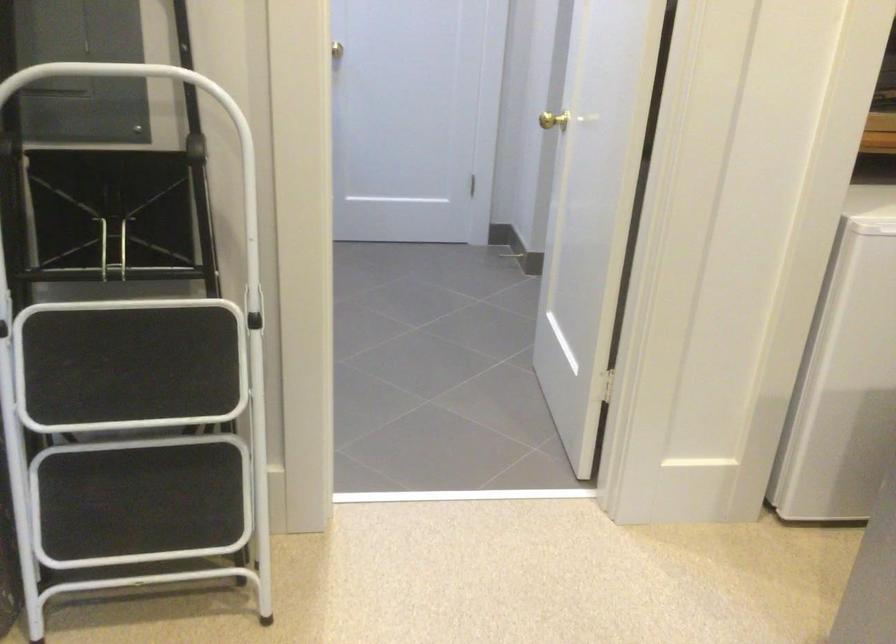
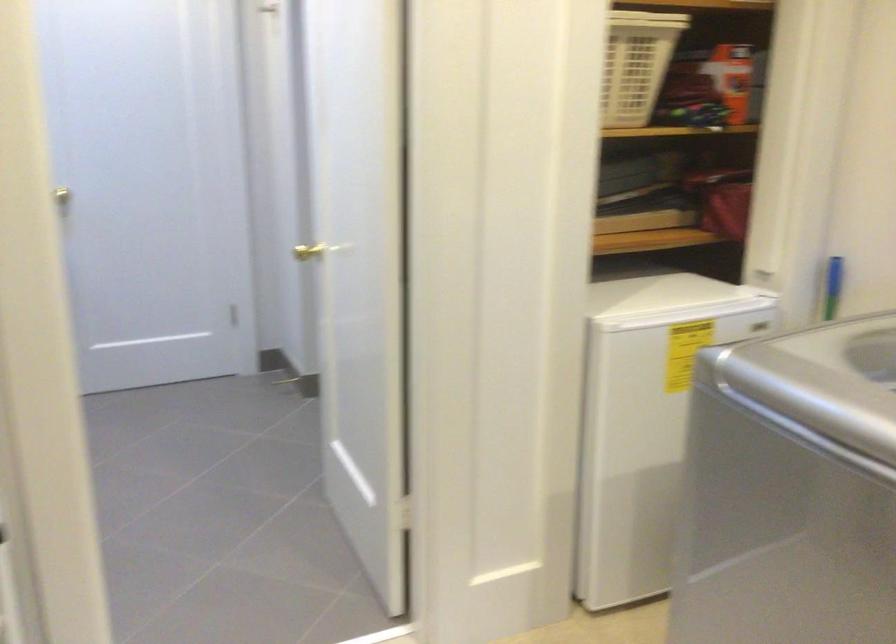
Question: How did the camera likely rotate?

Choices:
 (A) Left
 (B) Right
 (C) Up
 (D) Down

Answer: (B)